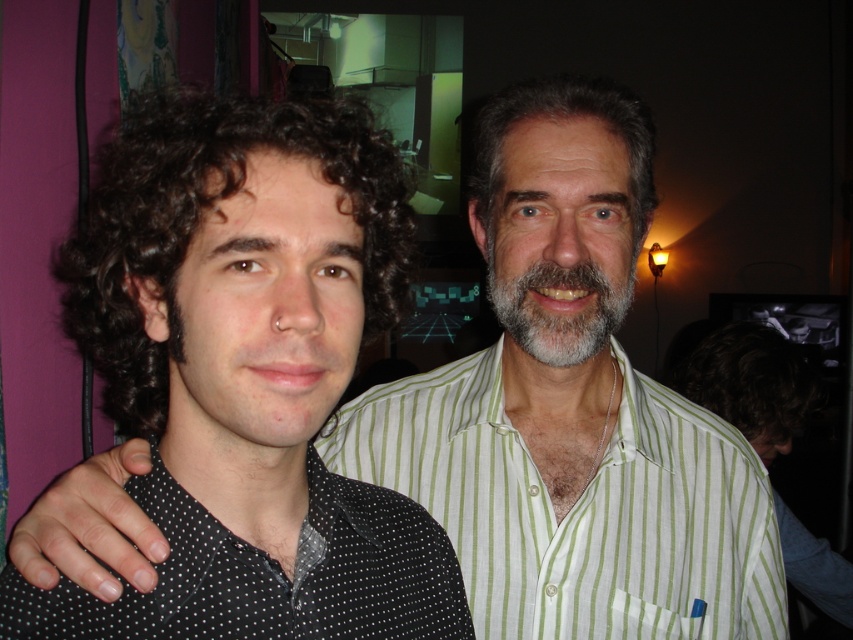
The image size is (853, 640). Describe the element at coordinates (563, 116) in the screenshot. I see `gray matte hair at upper center` at that location.

Between point (537, 97) and point (543, 328), which one is positioned in front?

Point (543, 328)

This screenshot has height=640, width=853. Describe the element at coordinates (563, 116) in the screenshot. I see `gray matte hair at upper center` at that location.

The width and height of the screenshot is (853, 640). I want to click on gray matte hair at upper center, so click(x=563, y=116).

Which is above, green striped shirt at center or dark curly hair at left?

dark curly hair at left is higher up.

Between green striped shirt at center and dark curly hair at left, which one is positioned lower?

green striped shirt at center is lower down.

Where is `green striped shirt at center`? The width and height of the screenshot is (853, 640). green striped shirt at center is located at coordinates (578, 508).

Who is lower down, green striped shirt at center or grayhairbeard at center?

green striped shirt at center is lower down.

Who is positioned more to the left, green striped shirt at center or grayhairbeard at center?

grayhairbeard at center

Does point (683, 541) lie behind point (519, 292)?

Yes, it is.

Where is `green striped shirt at center`? The width and height of the screenshot is (853, 640). green striped shirt at center is located at coordinates coord(578,508).